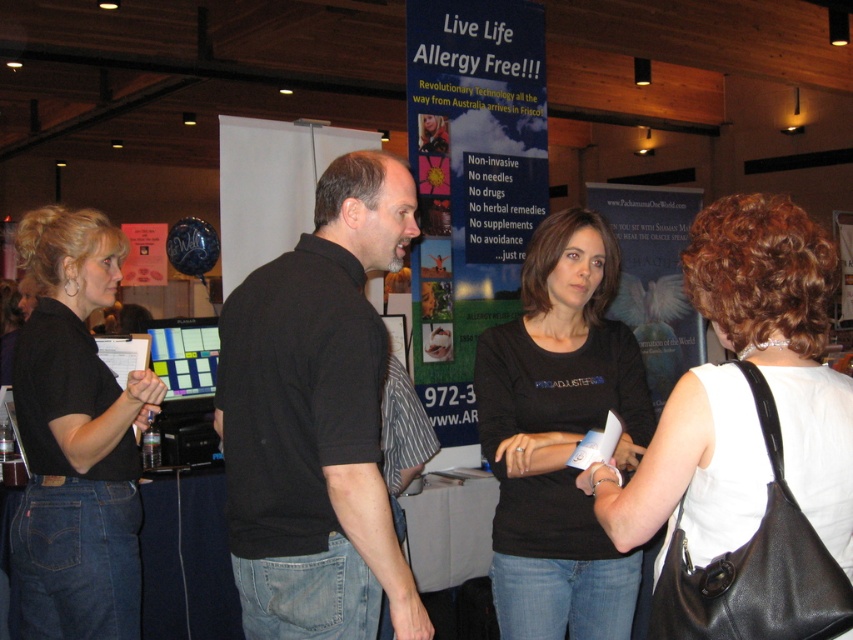
Is point (251, 396) in front of point (78, 353)?

Yes, it is in front of point (78, 353).

Between black cotton shirt at center and black matte shirt at left, which one has more height?

Standing taller between the two is black matte shirt at left.

Does point (256, 550) come farther from viewer compared to point (64, 273)?

No, (256, 550) is closer to viewer.

Find the location of a particular element. This screenshot has width=853, height=640. black cotton shirt at center is located at coordinates (316, 419).

Between point (306, 592) and point (824, 326), which one is positioned in front?

Point (824, 326) is more forward.

Who is more distant from viewer, (x=305, y=392) or (x=740, y=493)?

Point (x=305, y=392)

Is point (314, 566) less distant than point (820, 314)?

No, (314, 566) is further to viewer.

The width and height of the screenshot is (853, 640). Find the location of `black cotton shirt at center`. black cotton shirt at center is located at coordinates (316, 419).

Is black matte shirt at center positioned at the back of black matte shirt at left?

No, black matte shirt at center is closer to the viewer.

Is black matte shirt at center below black matte shirt at left?

Actually, black matte shirt at center is above black matte shirt at left.

Is point (524, 556) positioned in front of point (80, 502)?

Yes, point (524, 556) is closer to viewer.

Where is `black matte shirt at center`? black matte shirt at center is located at coordinates (560, 435).